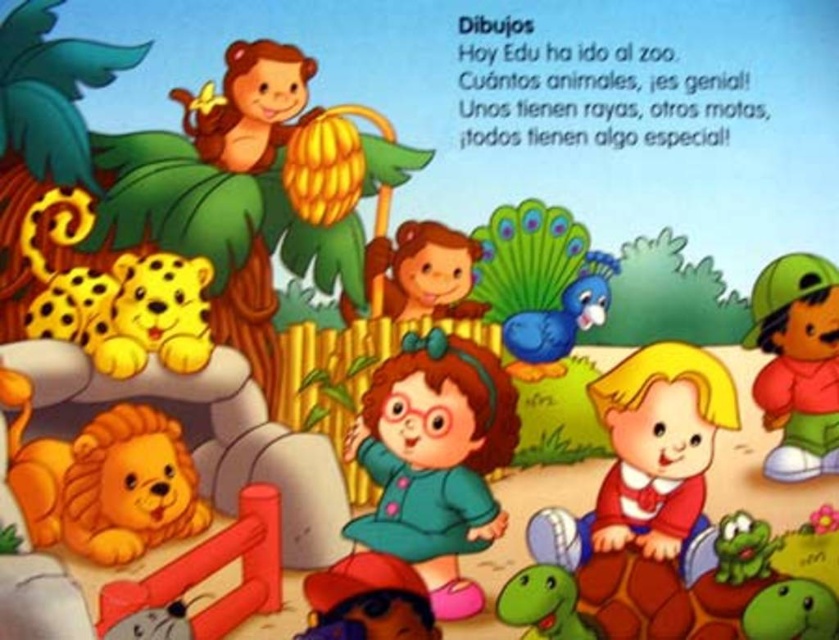
You are a zookeeper who needs to place a new feeding station between the yellow matte leopard at lower left and the children. How far apart should the feeding station be placed from each object to ensure equal distance?

The feeding station should be placed exactly halfway between the yellow matte leopard at lower left and the children, maintaining a distance of 3.59 feet from each.

In the zoo scene, there is an orange matte monkey at upper left and a matte plastic toy at lower center. From the perspective of a child standing in the middle of the image, which object would block the view of the other?

The orange matte monkey at upper left is in front of the matte plastic toy at lower center, so the orange matte monkey at upper left would block the view of the matte plastic toy at lower center from the child standing in the middle.